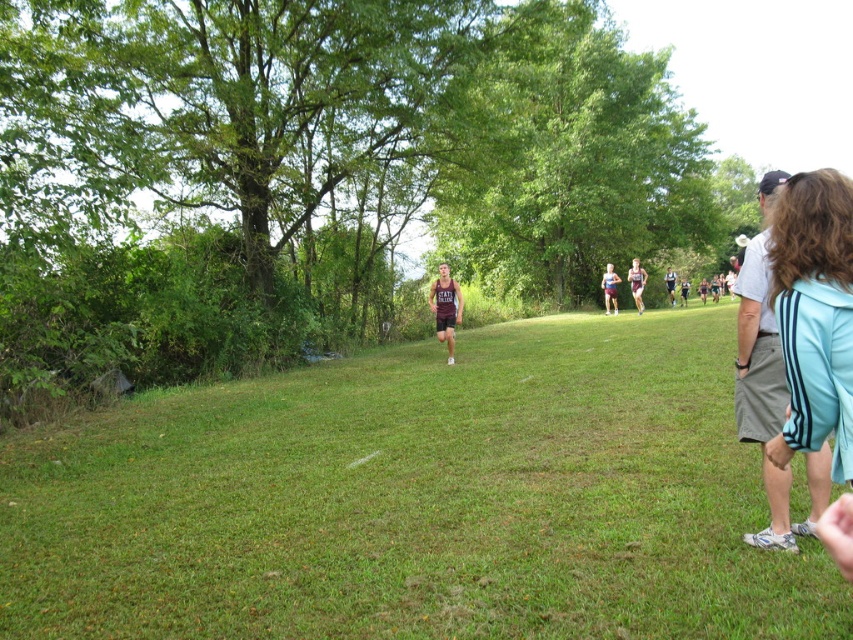
From the picture: Does green grassy field at center appear under white cotton shirt at right?

Yes, green grassy field at center is below white cotton shirt at right.

Which is more to the left, green grassy field at center or white cotton shirt at right?

From the viewer's perspective, green grassy field at center appears more on the left side.

Measure the distance between point (624, 449) and camera.

A distance of 7.55 meters exists between point (624, 449) and camera.

At what (x,y) coordinates should I click in order to perform the action: click on green grassy field at center. Please return your answer as a coordinate pair (x, y). Looking at the image, I should click on (416, 499).

Which is more to the right, white cotton shirt at right or maroon jersey at center?

Positioned to the right is white cotton shirt at right.

Who is shorter, white cotton shirt at right or maroon jersey at center?

With less height is maroon jersey at center.

This screenshot has height=640, width=853. In order to click on white cotton shirt at right in this screenshot , I will do `click(769, 378)`.

Is point (479, 166) closer to viewer compared to point (747, 387)?

That is False.

Who is lower down, green leafy tree at center or white cotton shirt at right?

Positioned lower is white cotton shirt at right.

Locate an element on the screen. The width and height of the screenshot is (853, 640). green leafy tree at center is located at coordinates (567, 160).